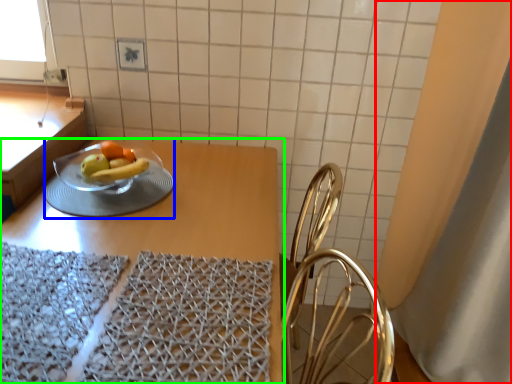
Question: Which object is the farthest from curtain (highlighted by a red box)? Choose among these: tableware (highlighted by a blue box) or table (highlighted by a green box).

Choices:
 (A) tableware
 (B) table

Answer: (A)